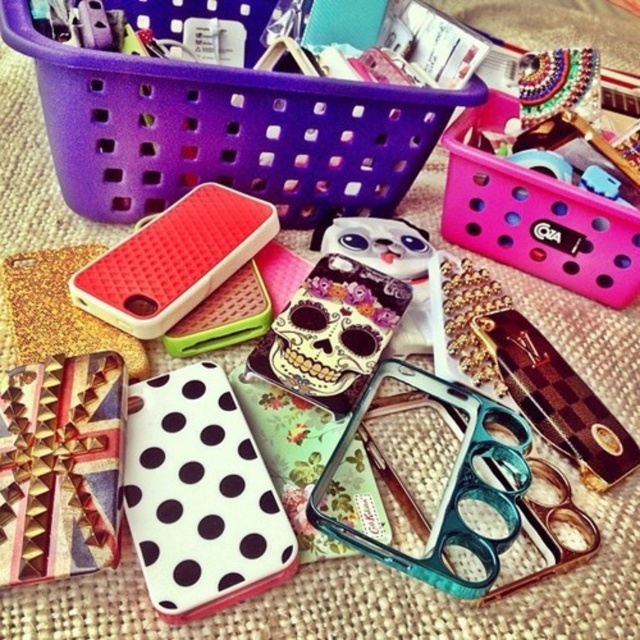
You are organizing a store display and need to place the matte skull case at center on top of the pink plastic basket at upper right. Can you do this without the case falling off?

The pink plastic basket at upper right is much taller than the matte skull case at center, so placing the matte skull case at center on top of it should be stable as the basket provides a secure base.

You are standing at the edge of the woven surface where the phone cases are displayed. You notice two points marked on the image. The first point is at coordinate point (368, 92) and the second point is at coordinate point (348, 339). Which point is closer to you?

Point (368, 92) is in front of point (348, 339), so it is closer to you.